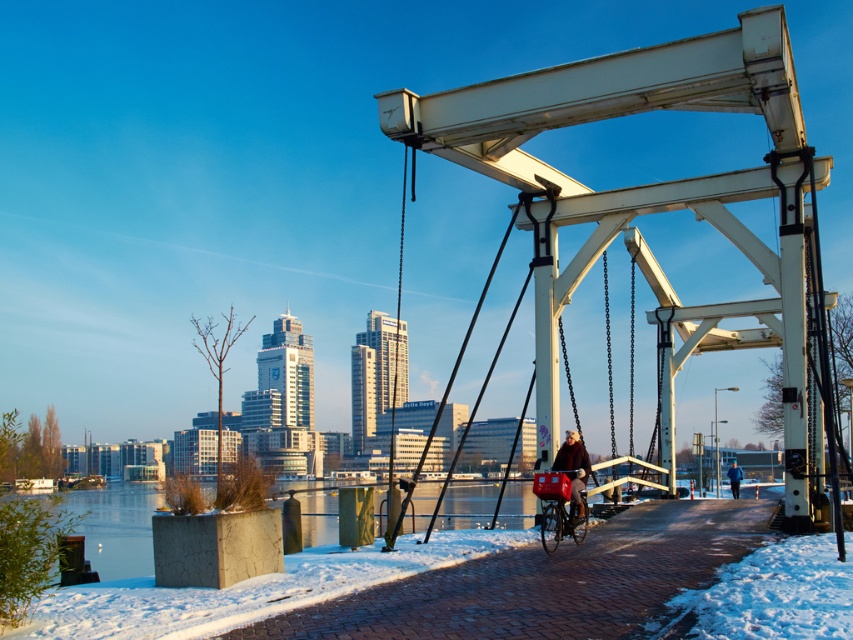
You are a delivery person who needs to ride your matte red bicycle at lower center through the snow on the pathway. The dark blue jacket at center is a passenger on the bike. Is the passenger able to stand upright while riding?

The matte red bicycle at lower center is not as tall as dark blue jacket at center, meaning the bicycle is shorter than the passenger. Since the passenger is taller than the bike, they should be able to stand upright while riding.

You are standing at the edge of the paved pathway in the winter scene. You see the matte red bicycle at lower center and the dark brown leather jacket at center. Which object is nearer to you?

The matte red bicycle at lower center is closer to the viewer than the dark brown leather jacket at center.